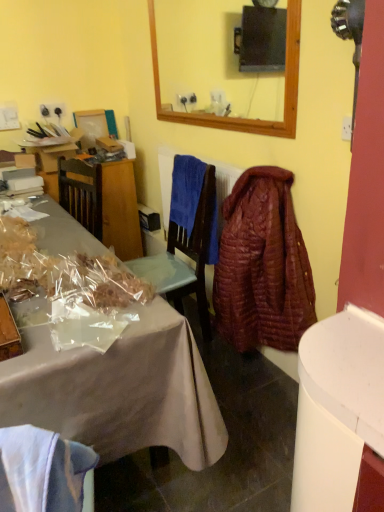
Measure the distance between quilted brown robe at center right and camera.

1.90 meters.

At what (x,y) coordinates should I click in order to perform the action: click on metallic cardboard box at lower left. Please return your answer as a coordinate pair (x, y). Image resolution: width=384 pixels, height=512 pixels. Looking at the image, I should click on (8, 332).

Identify the location of quilted brown robe at center right. (262, 265).

From a real-world perspective, between blue soft towel at center and quilted brown robe at center right, who is vertically higher?

blue soft towel at center, from a real-world perspective.

Is blue soft towel at center positioned behind quilted brown robe at center right?

Yes, blue soft towel at center is further from the camera.

Consider the image. Is blue soft towel at center looking in the opposite direction of quilted brown robe at center right?

blue soft towel at center is not turned away from quilted brown robe at center right.

Can you tell me how much blue soft towel at center and quilted brown robe at center right differ in facing direction?

0.00203 degrees separate the facing orientations of blue soft towel at center and quilted brown robe at center right.

Considering the sizes of objects blue soft towel at center and metallic cardboard box at lower left in the image provided, who is thinner, blue soft towel at center or metallic cardboard box at lower left?

blue soft towel at center is thinner.

Image resolution: width=384 pixels, height=512 pixels. What are the coordinates of `box lying on the left of blue soft towel at center` in the screenshot? It's located at (8, 332).

Between blue soft towel at center and metallic cardboard box at lower left, which one has smaller size?

With smaller size is metallic cardboard box at lower left.

Is point (175, 215) closer to camera compared to point (4, 333)?

No, (175, 215) is behind (4, 333).

Looking at the image, does quilted brown robe at center right seem bigger or smaller compared to blue soft towel at center?

Clearly, quilted brown robe at center right is larger in size than blue soft towel at center.

Is quilted brown robe at center right aimed at blue soft towel at center?

No, quilted brown robe at center right is not aimed at blue soft towel at center.

From the image's perspective, between quilted brown robe at center right and blue soft towel at center, who is located below?

quilted brown robe at center right is shown below in the image.

From a real-world perspective, is quilted brown robe at center right on top of blue soft towel at center?

No, from a real-world perspective, quilted brown robe at center right is not on top of blue soft towel at center.

Is metallic cardboard box at lower left facing towards blue soft towel at center?

No, metallic cardboard box at lower left is not turned towards blue soft towel at center.

Between metallic cardboard box at lower left and blue soft towel at center, which one is positioned behind?

blue soft towel at center is further from the camera.

Considering the positions of points (12, 320) and (172, 186), is point (12, 320) farther from camera compared to point (172, 186)?

No.

From the picture: Looking at their sizes, would you say metallic cardboard box at lower left is wider or thinner than blue soft towel at center?

Considering their sizes, metallic cardboard box at lower left looks broader than blue soft towel at center.

Looking at the image, does quilted brown robe at center right seem bigger or smaller compared to metallic cardboard box at lower left?

In the image, quilted brown robe at center right appears to be larger than metallic cardboard box at lower left.

Which object is positioned more to the right, quilted brown robe at center right or metallic cardboard box at lower left?

From the viewer's perspective, quilted brown robe at center right appears more on the right side.

Is quilted brown robe at center right not close to metallic cardboard box at lower left?

Absolutely, quilted brown robe at center right is distant from metallic cardboard box at lower left.

At what (x,y) coordinates should I click in order to perform the action: click on robe lying on the right of metallic cardboard box at lower left. Please return your answer as a coordinate pair (x, y). The width and height of the screenshot is (384, 512). Looking at the image, I should click on (262, 265).

Can you confirm if metallic cardboard box at lower left is wider than quilted brown robe at center right?

Yes, metallic cardboard box at lower left is wider than quilted brown robe at center right.

Considering the relative positions of metallic cardboard box at lower left and quilted brown robe at center right in the image provided, is metallic cardboard box at lower left to the right of quilted brown robe at center right from the viewer's perspective?

In fact, metallic cardboard box at lower left is to the left of quilted brown robe at center right.

From a real-world perspective, is metallic cardboard box at lower left above or below quilted brown robe at center right?

Clearly, from a real-world perspective, metallic cardboard box at lower left is below quilted brown robe at center right.

Find the location of a particular element. The image size is (384, 512). cloth located above the quilted brown robe at center right (from the image's perspective) is located at coordinates (186, 190).

Find the location of a particular element. This screenshot has width=384, height=512. cloth behind the metallic cardboard box at lower left is located at coordinates (186, 190).

Which object lies further to the anchor point metallic cardboard box at lower left, blue soft towel at center or quilted brown robe at center right?

quilted brown robe at center right is positioned further to the anchor metallic cardboard box at lower left.

Which object lies nearer to the anchor point blue soft towel at center, metallic cardboard box at lower left or quilted brown robe at center right?

quilted brown robe at center right is closer to blue soft towel at center.

Considering their positions, is metallic cardboard box at lower left positioned closer to quilted brown robe at center right than blue soft towel at center?

blue soft towel at center lies closer to quilted brown robe at center right than the other object.

Estimate the real-world distances between objects in this image. Which object is further from metallic cardboard box at lower left, quilted brown robe at center right or blue soft towel at center?

The object further to metallic cardboard box at lower left is quilted brown robe at center right.

When comparing their distances from quilted brown robe at center right, does blue soft towel at center or metallic cardboard box at lower left seem closer?

The object closer to quilted brown robe at center right is blue soft towel at center.

Looking at this image, from the image, which object appears to be farther from blue soft towel at center, quilted brown robe at center right or metallic cardboard box at lower left?

Among the two, metallic cardboard box at lower left is located further to blue soft towel at center.

Where is `robe located between metallic cardboard box at lower left and blue soft towel at center in the depth direction`? Image resolution: width=384 pixels, height=512 pixels. robe located between metallic cardboard box at lower left and blue soft towel at center in the depth direction is located at coordinates point(262,265).